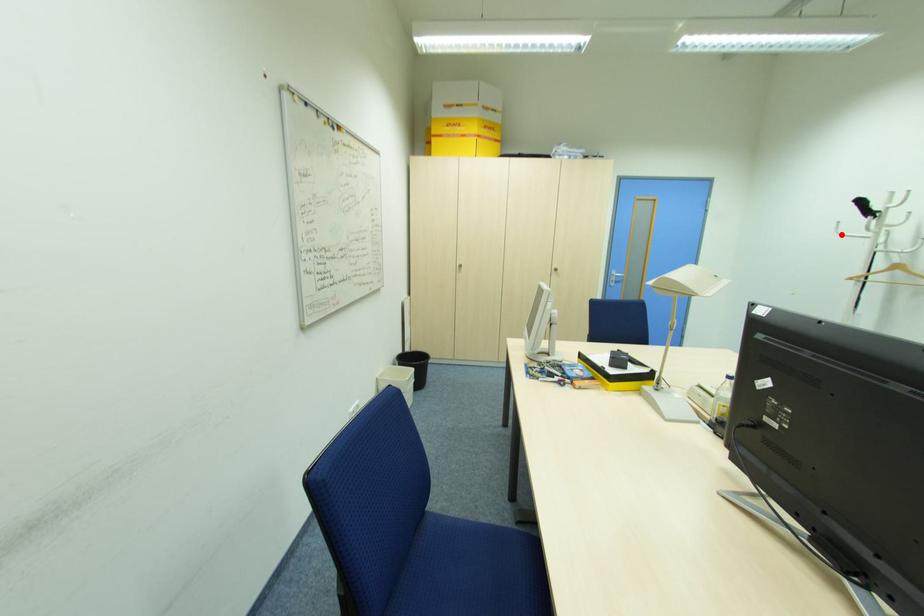
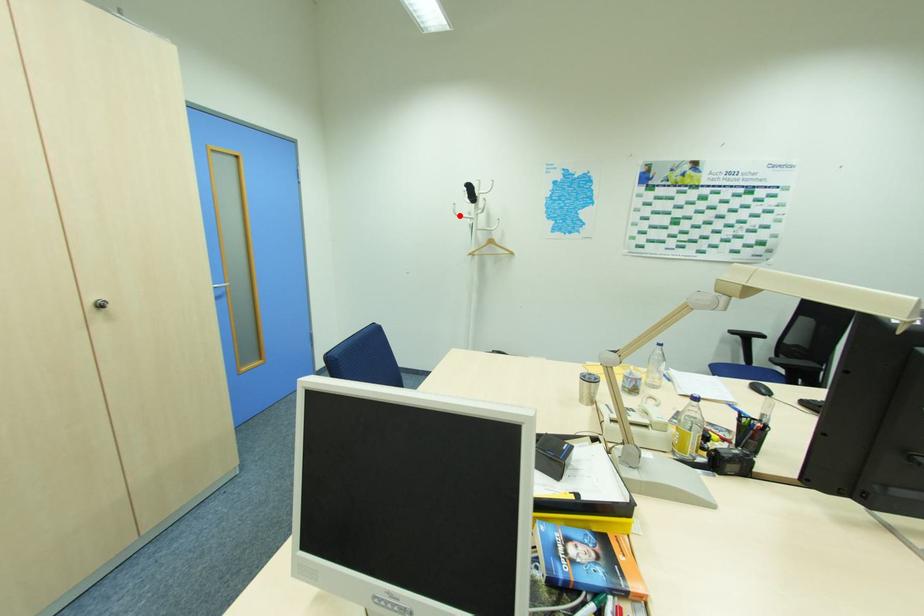
I am providing you with two images of the same scene from different viewpoints. A red point is marked on the first image and another point is marked on the second image. Are the points marked in image1 and image2 representing the same 3D position?

Yes